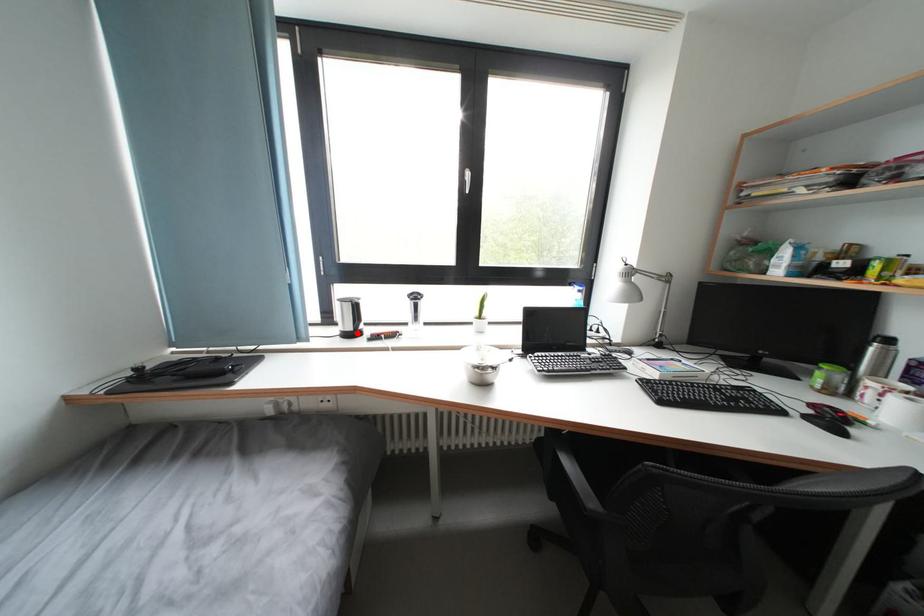
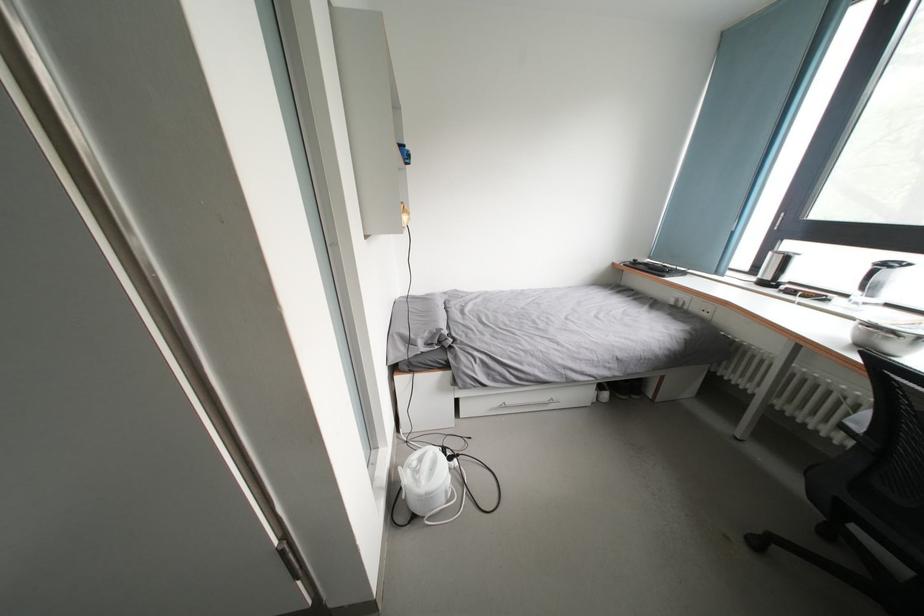
Find the pixel in the second image that matches the highlighted location in the first image.

(774, 283)